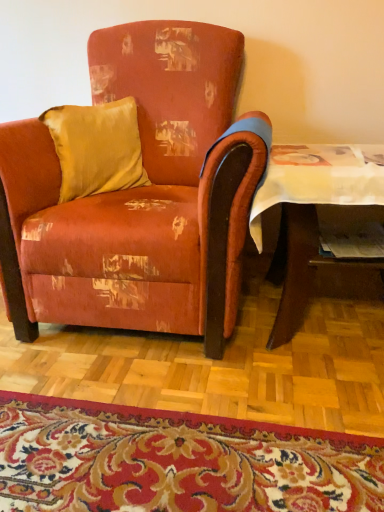
Question: Based on their positions, is wooden table at lower right located to the left or right of satin gold pillow at upper left?

Choices:
 (A) right
 (B) left

Answer: (A)

Question: From the image's perspective, is wooden table at lower right above or below satin gold pillow at upper left?

Choices:
 (A) above
 (B) below

Answer: (B)

Question: Estimate the real-world distances between objects in this image. Which object is closer to the carpet with floral pattern at lower center?

Choices:
 (A) wooden table at lower right
 (B) satin gold pillow at upper left
 (C) velvet orange armchair at center
 (D) matte paper magazine at lower right

Answer: (C)

Question: Estimate the real-world distances between objects in this image. Which object is farther from the satin gold pillow at upper left?

Choices:
 (A) wooden table at lower right
 (B) matte paper magazine at lower right
 (C) velvet orange armchair at center
 (D) carpet with floral pattern at lower center

Answer: (D)